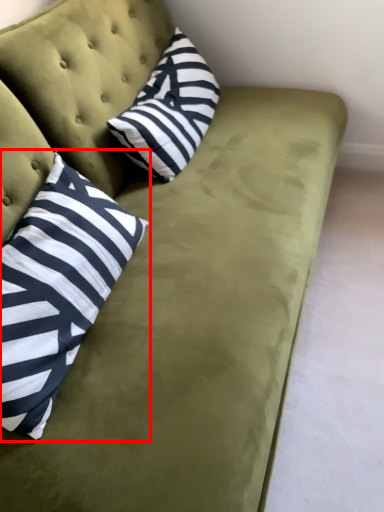
Question: From the image's perspective, where is pillow (annotated by the red box) located in relation to pillow in the image?

Choices:
 (A) below
 (B) above

Answer: (A)